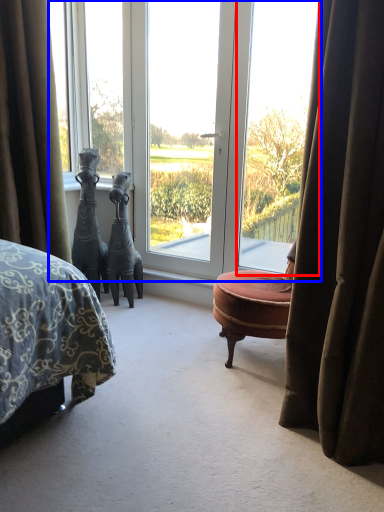
Question: Which of the following is the closest to the observer, window (highlighted by a red box) or window (highlighted by a blue box)?

Choices:
 (A) window
 (B) window

Answer: (A)